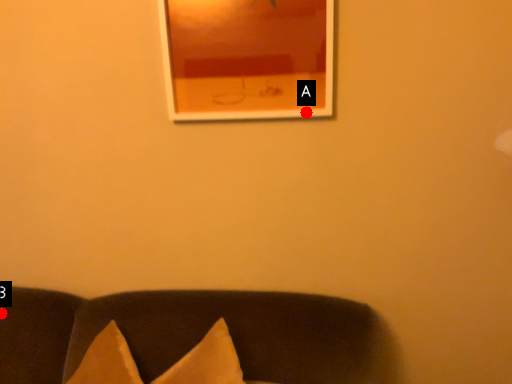
Question: Two points are circled on the image, labeled by A and B beside each circle. Which point is closer to the camera?

Choices:
 (A) A is closer
 (B) B is closer

Answer: (A)